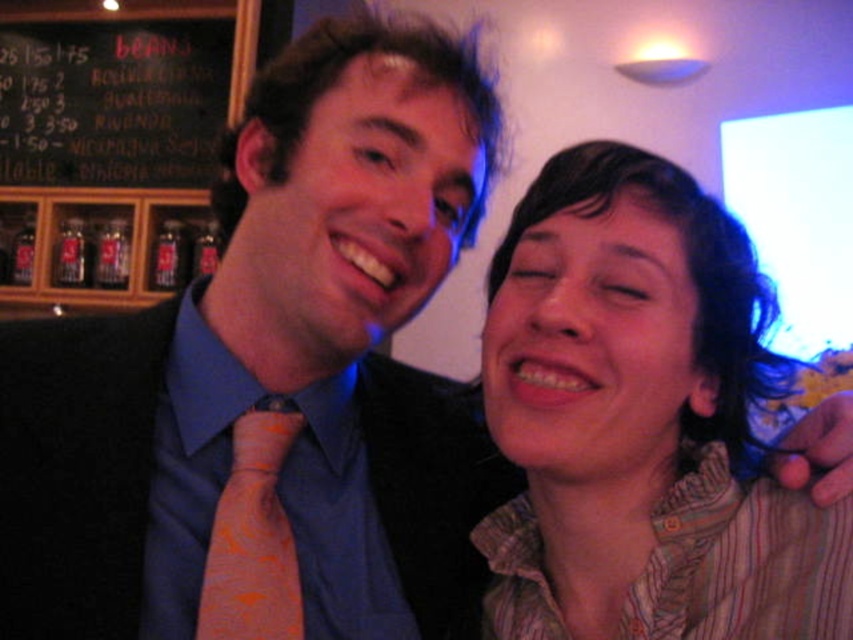
Based on the photo, you are a photographer at the event and want to capture a clear photo of the striped cotton shirt at right without the black chalkboard at upper left being visible in the background. Is this possible based on their positions?

The striped cotton shirt at right is in front of the black chalkboard at upper left, so it is possible to take a clear photo of the striped cotton shirt at right without the black chalkboard at upper left being visible in the background.

You are taking a photo of the black chalkboard at upper left and the orange patterned tie at center. Which object is located more to the left?

The black chalkboard at upper left is more to the left than the orange patterned tie at center.